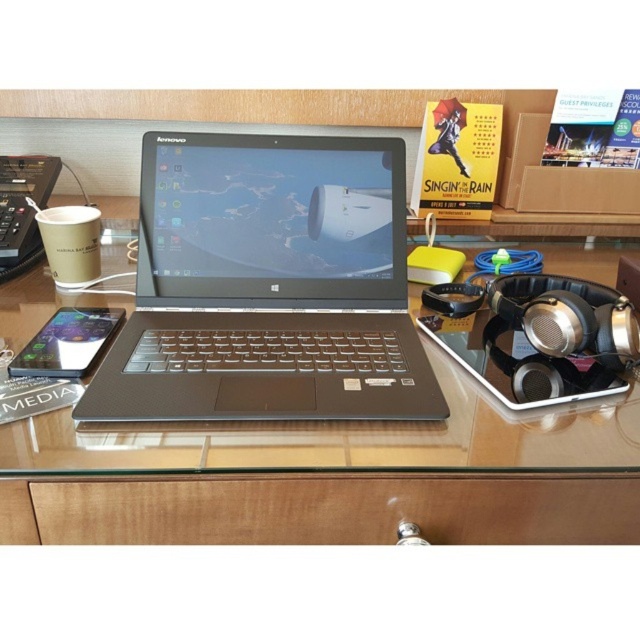
You are looking at the workspace and notice two points marked in the image. Which of these points, point 1 at coordinates [32,492] or point 2 at coordinates [29,353], is closer to your viewpoint?

Point 1 at coordinates [32,492] is closer to the camera than point 2 at coordinates [29,353].

You are a delivery robot with a 40 cm wide package. You need to place it on the glossy glass desk at center. Can you safely place it there without it falling off the edge?

The glossy glass desk at center is 43.83 centimeters away from the camera, so the distance is sufficient for placing a 40 cm wide package safely without it falling off the edge.